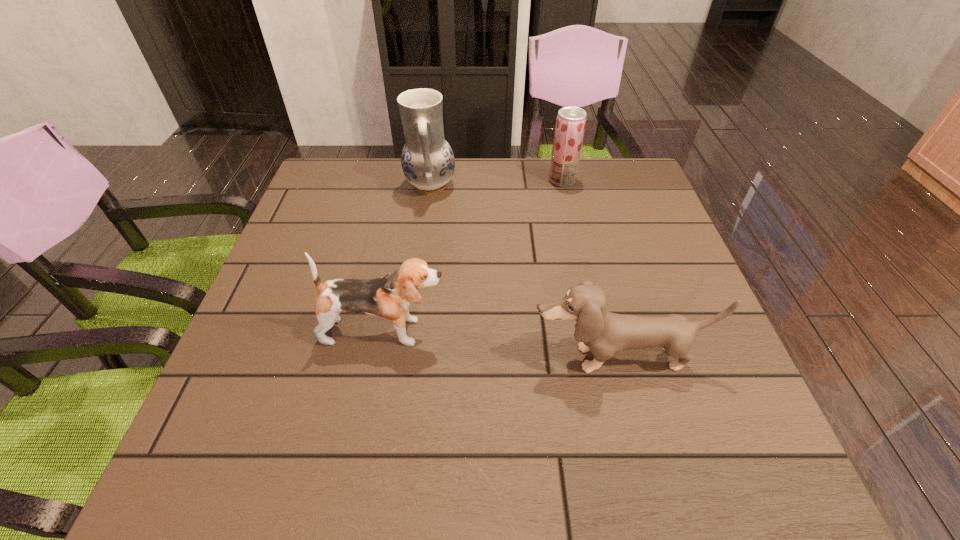
Identify the location of object that is at the left edge. (388, 297).

Where is `object that is at the right edge`? This screenshot has height=540, width=960. object that is at the right edge is located at coordinates (604, 333).

At what (x,y) coordinates should I click in order to perform the action: click on vacant space at the near edge of the desktop. Please return your answer as a coordinate pair (x, y). The width and height of the screenshot is (960, 540). Looking at the image, I should click on (426, 463).

Locate an element on the screen. vacant area at the left edge of the desktop is located at coordinates (315, 337).

You are a GUI agent. You are given a task and a screenshot of the screen. Output one action in this format:
    pyautogui.click(x=<x>, y=<y>)
    Task: Click on the free space at the right edge of the desktop
    
    Given the screenshot: What is the action you would take?
    pyautogui.click(x=616, y=247)

The image size is (960, 540). I want to click on vacant region at the far left corner of the desktop, so click(364, 176).

The image size is (960, 540). Find the location of `free space at the near left corner of the desktop`. free space at the near left corner of the desktop is located at coordinates (251, 475).

What are the coordinates of `vacant space at the far right corner` in the screenshot? It's located at (624, 194).

Find the location of a particular element. vacant area that lies between the left puppy and the tallest object is located at coordinates (407, 259).

The height and width of the screenshot is (540, 960). In order to click on vacant space that is in between the fruit juice and the right puppy in this screenshot , I will do point(590,269).